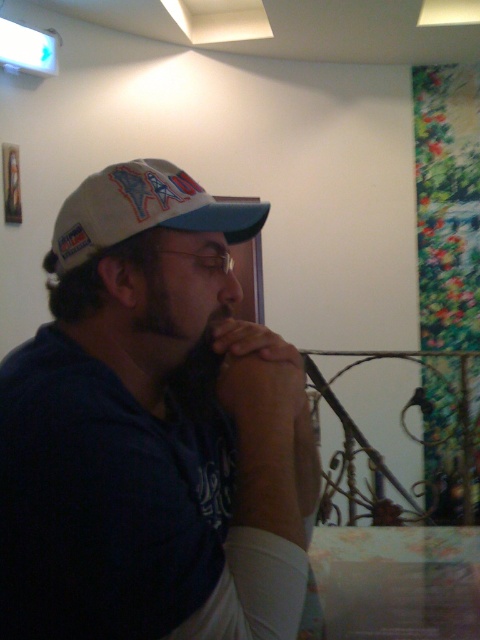
Does white fabric baseball cap at left have a lesser height compared to brown leather hand at center?

In fact, white fabric baseball cap at left may be taller than brown leather hand at center.

Is white fabric baseball cap at left behind brown leather hand at center?

No, it is not.

The width and height of the screenshot is (480, 640). What are the coordinates of `white fabric baseball cap at left` in the screenshot? It's located at (143, 211).

Find the location of a particular element. white fabric baseball cap at left is located at coordinates (143, 211).

Does white fabric shirt at center come in front of matte skin jaw at center?

Yes.

Does white fabric shirt at center have a larger size compared to matte skin jaw at center?

Indeed, white fabric shirt at center has a larger size compared to matte skin jaw at center.

The height and width of the screenshot is (640, 480). What are the coordinates of `white fabric shirt at center` in the screenshot? It's located at (153, 429).

Is point (279, 362) closer to camera compared to point (229, 310)?

That is True.

Between brown leather hand at center and matte skin jaw at center, which one appears on the right side from the viewer's perspective?

brown leather hand at center is more to the right.

What do you see at coordinates (252, 340) in the screenshot? Image resolution: width=480 pixels, height=640 pixels. I see `brown leather hand at center` at bounding box center [252, 340].

Locate an element on the screen. This screenshot has height=640, width=480. brown leather hand at center is located at coordinates (252, 340).